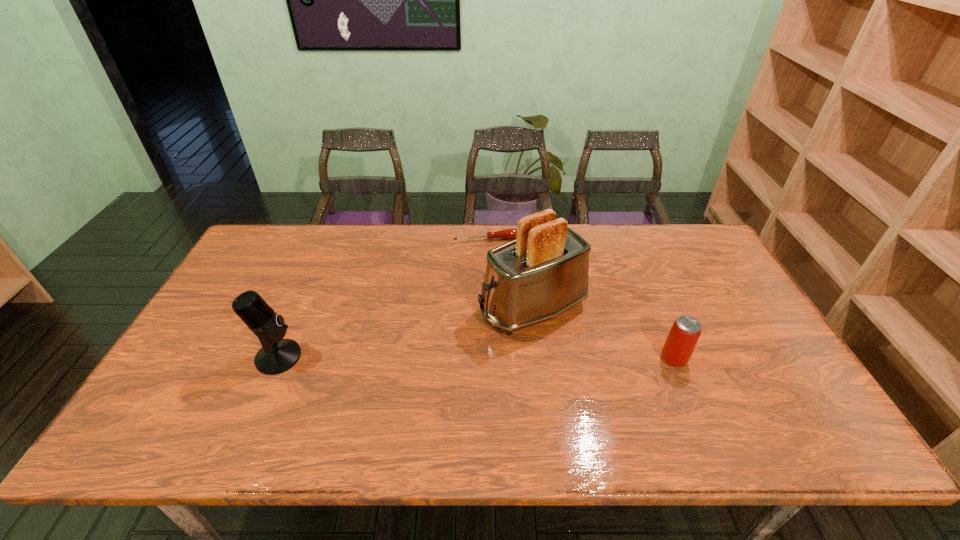
At what (x,y) coordinates should I click in order to perform the action: click on the second tallest object. Please return your answer as a coordinate pair (x, y). The width and height of the screenshot is (960, 540). Looking at the image, I should click on (277, 355).

This screenshot has height=540, width=960. What are the coordinates of `microphone` in the screenshot? It's located at (277, 355).

Locate an element on the screen. This screenshot has width=960, height=540. the second shortest object is located at coordinates (684, 334).

This screenshot has height=540, width=960. Identify the location of the rightmost object. (684, 334).

Find the location of `toaster`. toaster is located at coordinates (542, 273).

The width and height of the screenshot is (960, 540). Find the location of `the farthest object`. the farthest object is located at coordinates (510, 233).

You are a GUI agent. You are given a task and a screenshot of the screen. Output one action in this format:
    pyautogui.click(x=<x>, y=<y>)
    Task: Click on the shortest object
    The height and width of the screenshot is (540, 960).
    Given the screenshot: What is the action you would take?
    pyautogui.click(x=510, y=233)

Identify the location of vacant space located on the stand of the third shortest object. (416, 357).

The image size is (960, 540). Find the location of `vacant space located 0.100m on the front of the beer can`. vacant space located 0.100m on the front of the beer can is located at coordinates (692, 404).

The image size is (960, 540). Find the location of `free space located 0.100m on the side of the toaster with the control lever`. free space located 0.100m on the side of the toaster with the control lever is located at coordinates (x=453, y=339).